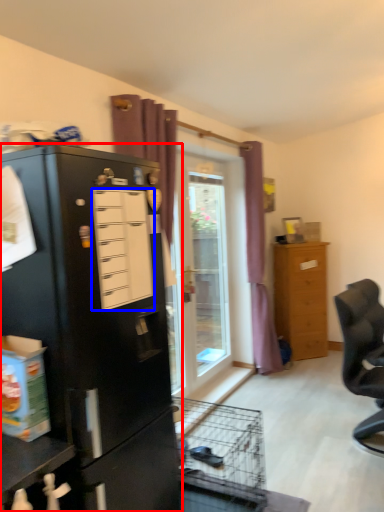
Question: Which of the following is the farthest to the observer, cupboard (highlighted by a red box) or drawer (highlighted by a blue box)?

Choices:
 (A) cupboard
 (B) drawer

Answer: (B)